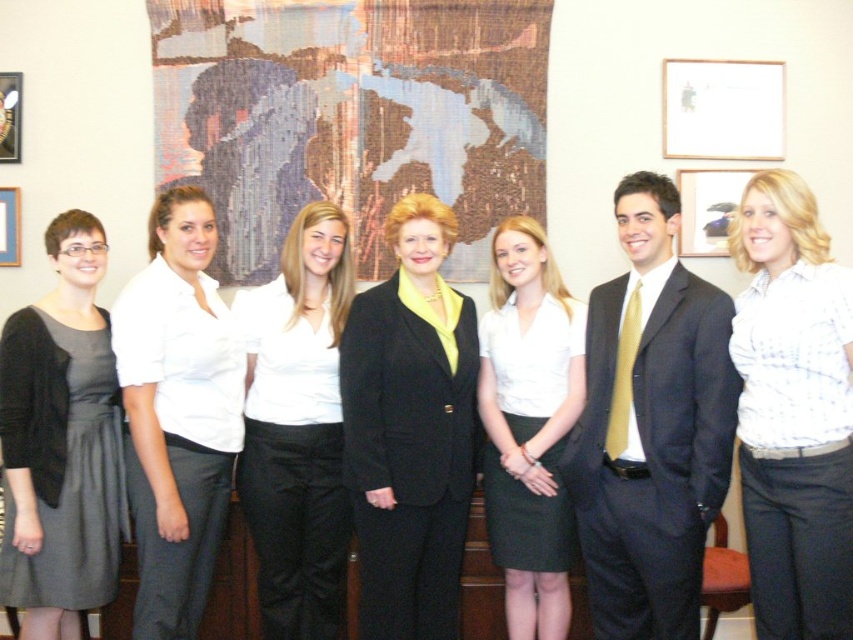
Question: Is black wool suit at center above gray matte dress at left?

Choices:
 (A) yes
 (B) no

Answer: (B)

Question: Which of the following is the closest to the observer?

Choices:
 (A) (618, 419)
 (B) (686, 125)
 (C) (13, 93)
 (D) (3, 186)

Answer: (A)

Question: Which is farther from the white paper at upper right?

Choices:
 (A) white matte skirt at center
 (B) gray matte dress at left
 (C) brushed metal picture frame at upper left

Answer: (C)

Question: Can you confirm if white checkered shirt at center is bigger than white smooth shirt at center?

Choices:
 (A) no
 (B) yes

Answer: (A)

Question: Does matte black suit at center have a smaller size compared to wooden picture frame at upper left?

Choices:
 (A) yes
 (B) no

Answer: (B)

Question: Which point is closer to the camera taking this photo?

Choices:
 (A) (465, 474)
 (B) (689, 132)
 (C) (10, 243)

Answer: (A)